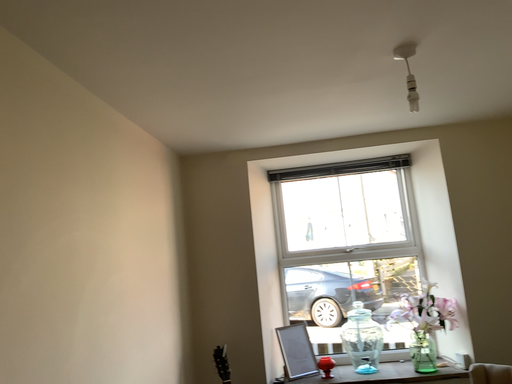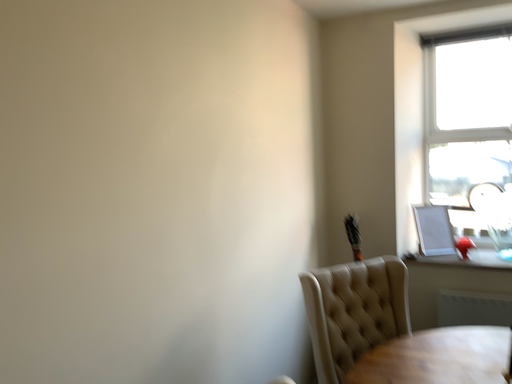
Question: How did the camera likely rotate when shooting the video?

Choices:
 (A) rotated upward
 (B) rotated downward

Answer: (B)